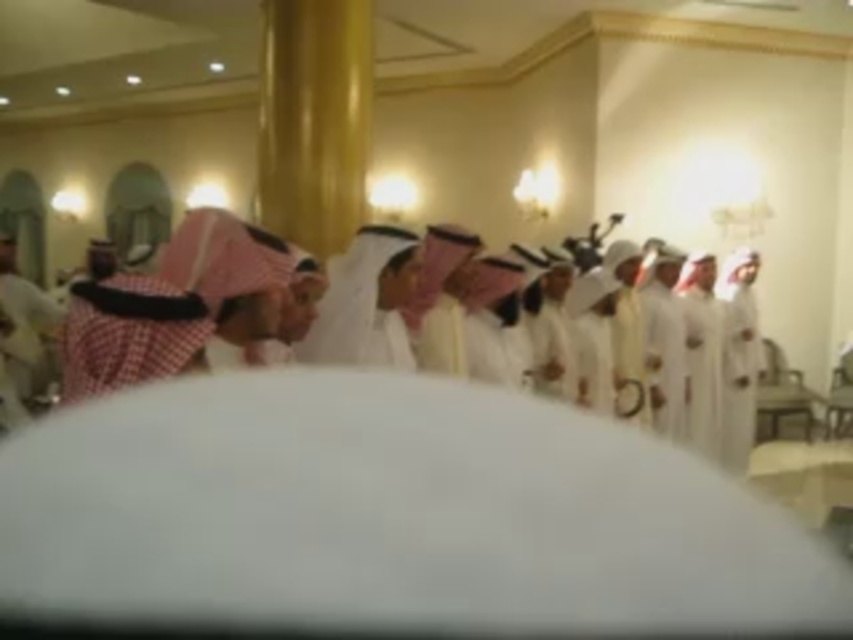
Which is behind, point (724, 404) or point (708, 291)?

Point (708, 291)

Who is positioned more to the left, white cotton robe at right or white matte robe at right?

From the viewer's perspective, white matte robe at right appears more on the left side.

Is point (730, 435) positioned behind point (711, 444)?

Yes, point (730, 435) is farther from viewer.

Locate an element on the screen. white cotton robe at right is located at coordinates (740, 374).